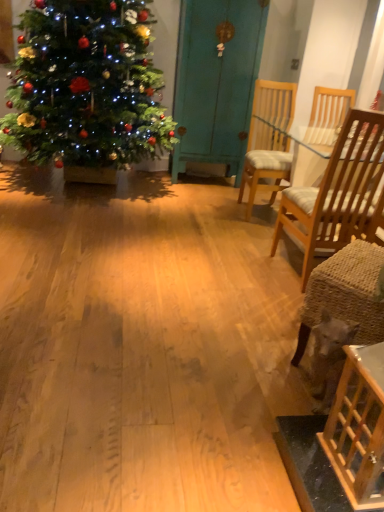
What do you see at coordinates (337, 191) in the screenshot? The height and width of the screenshot is (512, 384). I see `light brown wood chair at right, positioned as the 2th chair in back-to-front order` at bounding box center [337, 191].

In order to face wooden chair with cushion at center, positioned as the first chair in back-to-front order, should I rotate leftwards or rightwards?

Rotate your view right by about 11.201°.

Locate an element on the screen. This screenshot has width=384, height=512. light brown wood chair at right, which is the first chair from front to back is located at coordinates (337, 191).

Considering the points (285, 209) and (167, 49), which point is in front, point (285, 209) or point (167, 49)?

Positioned in front is point (285, 209).

Does light brown wood chair at right, which is the first chair from front to back, turn towards shiny green christmas tree at left?

No, light brown wood chair at right, which is the first chair from front to back, is not aimed at shiny green christmas tree at left.

Considering the positions of objects light brown wood chair at right, which is the first chair from front to back, and shiny green christmas tree at left in the image provided, who is behind, light brown wood chair at right, which is the first chair from front to back, or shiny green christmas tree at left?

Positioned behind is shiny green christmas tree at left.

Is light brown wood chair at right, positioned as the 2th chair in back-to-front order, not close to shiny green christmas tree at left?

light brown wood chair at right, positioned as the 2th chair in back-to-front order, is far away from shiny green christmas tree at left.

Is point (336, 473) in front of point (211, 106)?

Yes, point (336, 473) is in front of point (211, 106).

In terms of width, does wooden table at lower right look wider or thinner when compared to teal painted wood armoire at center?

Clearly, wooden table at lower right has less width compared to teal painted wood armoire at center.

Is wooden table at lower right taller than teal painted wood armoire at center?

In fact, wooden table at lower right may be shorter than teal painted wood armoire at center.

Based on the photo, is shiny green christmas tree at left touching teal painted wood armoire at center?

No, shiny green christmas tree at left is not in contact with teal painted wood armoire at center.

In the scene shown: Considering the sizes of objects shiny green christmas tree at left and teal painted wood armoire at center in the image provided, who is thinner, shiny green christmas tree at left or teal painted wood armoire at center?

With smaller width is teal painted wood armoire at center.

Is shiny green christmas tree at left positioned with its back to teal painted wood armoire at center?

No, shiny green christmas tree at left is not facing away from teal painted wood armoire at center.

From the picture: From a real-world perspective, is shiny green christmas tree at left above or below teal painted wood armoire at center?

Clearly, from a real-world perspective, shiny green christmas tree at left is below teal painted wood armoire at center.

Can you confirm if wooden table at lower right is smaller than light brown wood chair at right, positioned as the 2th chair in back-to-front order?

Indeed, wooden table at lower right has a smaller size compared to light brown wood chair at right, positioned as the 2th chair in back-to-front order.

Which object is closer to the camera, wooden table at lower right or light brown wood chair at right, which is the first chair from front to back?

wooden table at lower right is closer to the camera.

Is wooden table at lower right facing towards light brown wood chair at right, which is the first chair from front to back?

No, wooden table at lower right is not aimed at light brown wood chair at right, which is the first chair from front to back.

From the image's perspective, between wooden table at lower right and light brown wood chair at right, which is the first chair from front to back, which one is located above?

From the image's view, light brown wood chair at right, which is the first chair from front to back, is above.

From a real-world perspective, which chair is the 1st one underneath the teal painted wood armoire at center? Please provide its 2D coordinates.

[(268, 139)]

Is wooden chair with cushion at center, marked as the second chair in a front-to-back arrangement, at the back of teal painted wood armoire at center?

No, teal painted wood armoire at center's orientation is not away from wooden chair with cushion at center, marked as the second chair in a front-to-back arrangement.

From the picture: Which is nearer, (209,141) or (250,152)?

Clearly, point (209,141) is more distant from the camera than point (250,152).

Is teal painted wood armoire at center positioned with its back to wooden table at lower right?

No, teal painted wood armoire at center is not facing the opposite direction of wooden table at lower right.

Is teal painted wood armoire at center shorter than wooden table at lower right?

In fact, teal painted wood armoire at center may be taller than wooden table at lower right.

Considering the sizes of objects teal painted wood armoire at center and wooden table at lower right in the image provided, who is thinner, teal painted wood armoire at center or wooden table at lower right?

Thinner between the two is wooden table at lower right.

Which object is further away from the camera taking this photo, light brown wood chair at right, which is the first chair from front to back, or wooden chair with cushion at center, marked as the second chair in a front-to-back arrangement?

wooden chair with cushion at center, marked as the second chair in a front-to-back arrangement, is behind.

From a real-world perspective, is light brown wood chair at right, positioned as the 2th chair in back-to-front order, positioned under wooden chair with cushion at center, marked as the second chair in a front-to-back arrangement, based on gravity?

Yes.

Based on the photo, considering the sizes of light brown wood chair at right, positioned as the 2th chair in back-to-front order, and wooden chair with cushion at center, marked as the second chair in a front-to-back arrangement, in the image, is light brown wood chair at right, positioned as the 2th chair in back-to-front order, taller or shorter than wooden chair with cushion at center, marked as the second chair in a front-to-back arrangement,?

In the image, light brown wood chair at right, positioned as the 2th chair in back-to-front order, appears to be taller than wooden chair with cushion at center, marked as the second chair in a front-to-back arrangement.

Locate an element on the screen. This screenshot has height=512, width=384. christmas tree that appears above the light brown wood chair at right, positioned as the 2th chair in back-to-front order (from the image's perspective) is located at coordinates (166, 45).

At what (x,y) coordinates should I click in order to perform the action: click on table in front of the teal painted wood armoire at center. Please return your answer as a coordinate pair (x, y). Looking at the image, I should click on pos(358,426).

Estimate the real-world distances between objects in this image. Which object is further from teal painted wood armoire at center, wooden chair with cushion at center, positioned as the first chair in back-to-front order, or wooden table at lower right?

Based on the image, wooden table at lower right appears to be further to teal painted wood armoire at center.

From the image, which object appears to be farther from teal painted wood armoire at center, light brown wood chair at right, which is the first chair from front to back, or shiny green christmas tree at left?

light brown wood chair at right, which is the first chair from front to back, is positioned further to the anchor teal painted wood armoire at center.

Based on their spatial positions, is shiny green christmas tree at left or light brown wood chair at right, positioned as the 2th chair in back-to-front order, further from teal painted wood armoire at center?

light brown wood chair at right, positioned as the 2th chair in back-to-front order, is positioned further to the anchor teal painted wood armoire at center.

From the image, which object appears to be nearer to wooden table at lower right, wooden chair with cushion at center, marked as the second chair in a front-to-back arrangement, or shiny green christmas tree at left?

wooden chair with cushion at center, marked as the second chair in a front-to-back arrangement, lies closer to wooden table at lower right than the other object.

From the image, which object appears to be nearer to shiny green christmas tree at left, wooden table at lower right or light brown wood chair at right, which is the first chair from front to back?

The object closer to shiny green christmas tree at left is light brown wood chair at right, which is the first chair from front to back.

Considering their positions, is shiny green christmas tree at left positioned further to light brown wood chair at right, positioned as the 2th chair in back-to-front order, than teal painted wood armoire at center?

Among the two, shiny green christmas tree at left is located further to light brown wood chair at right, positioned as the 2th chair in back-to-front order.

Considering their positions, is wooden chair with cushion at center, positioned as the first chair in back-to-front order, positioned closer to wooden table at lower right than teal painted wood armoire at center?

wooden chair with cushion at center, positioned as the first chair in back-to-front order, lies closer to wooden table at lower right than the other object.

Based on their spatial positions, is wooden chair with cushion at center, marked as the second chair in a front-to-back arrangement, or shiny green christmas tree at left further from light brown wood chair at right, positioned as the 2th chair in back-to-front order?

shiny green christmas tree at left is further to light brown wood chair at right, positioned as the 2th chair in back-to-front order.

Find the location of a particular element. The height and width of the screenshot is (512, 384). christmas tree located between wooden table at lower right and wooden chair with cushion at center, positioned as the first chair in back-to-front order, in the depth direction is located at coordinates (166, 45).

Locate an element on the screen. The width and height of the screenshot is (384, 512). armoire situated between shiny green christmas tree at left and light brown wood chair at right, positioned as the 2th chair in back-to-front order, from left to right is located at coordinates (216, 81).

The image size is (384, 512). I want to click on table between shiny green christmas tree at left and light brown wood chair at right, which is the first chair from front to back, so click(358, 426).

Where is `chair between light brown wood chair at right, positioned as the 2th chair in back-to-front order, and teal painted wood armoire at center in the front-back direction`? This screenshot has width=384, height=512. chair between light brown wood chair at right, positioned as the 2th chair in back-to-front order, and teal painted wood armoire at center in the front-back direction is located at coordinates [268, 139].